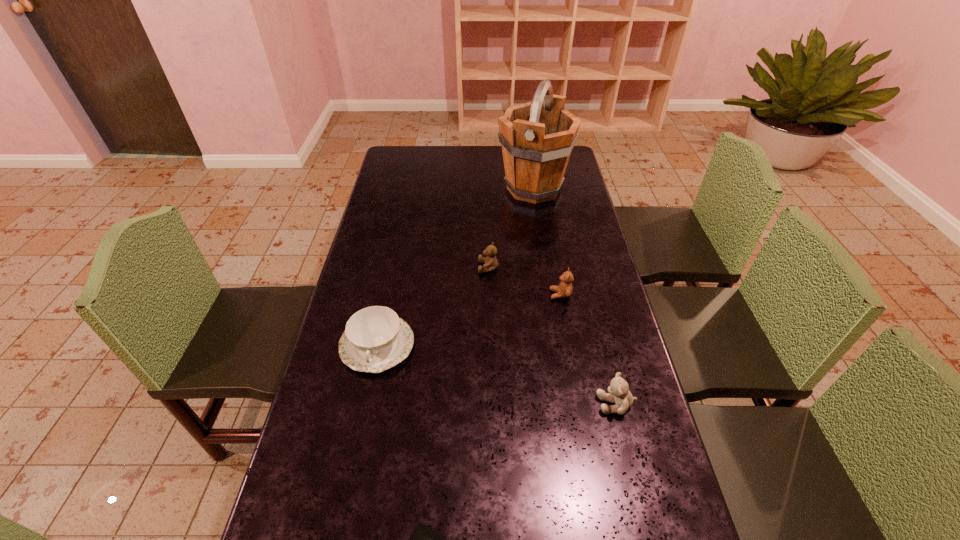
Locate an element on the screen. unoccupied position between the third nearest object and the second nearest teddy bear is located at coordinates (468, 320).

Where is `free space that is in between the second nearest object and the farthest teddy bear`? This screenshot has width=960, height=540. free space that is in between the second nearest object and the farthest teddy bear is located at coordinates (552, 335).

Find the location of a particular element. The height and width of the screenshot is (540, 960). free space between the bucket and the chinaware is located at coordinates (455, 267).

What are the coordinates of `the third closest object to the tallest object` in the screenshot? It's located at tap(375, 339).

Find the location of a particular element. The height and width of the screenshot is (540, 960). object identified as the fourth closest to the chinaware is located at coordinates (619, 393).

Identify the location of teddy bear that is the second closest to the bucket. Image resolution: width=960 pixels, height=540 pixels. (564, 289).

This screenshot has width=960, height=540. I want to click on teddy bear that can be found as the closest to the tallest object, so click(x=490, y=261).

The width and height of the screenshot is (960, 540). I want to click on vacant region that satisfies the following two spatial constraints: 1. on the front-facing side of the second farthest object; 2. on the handle side of the fourth farthest object, so click(490, 345).